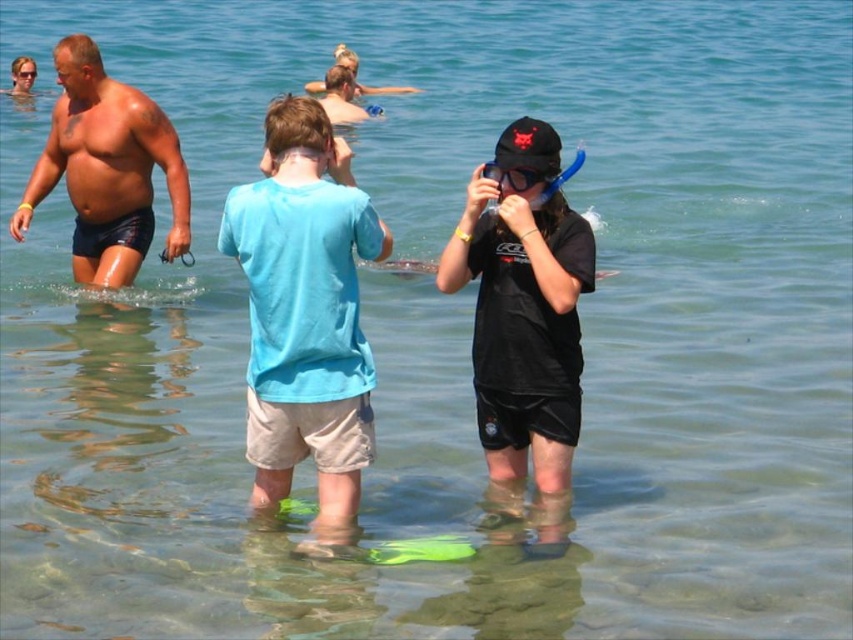
You are a swimmer who wants to use a snorkel to see underwater. Which snorkel, the black matte snorkel at center or the transparent rubber snorkel at center, would allow you to see the sandy bottom better?

The transparent rubber snorkel at center would allow you to see the sandy bottom better because it is above the black matte snorkel at center, making it more accessible and visible in the water.